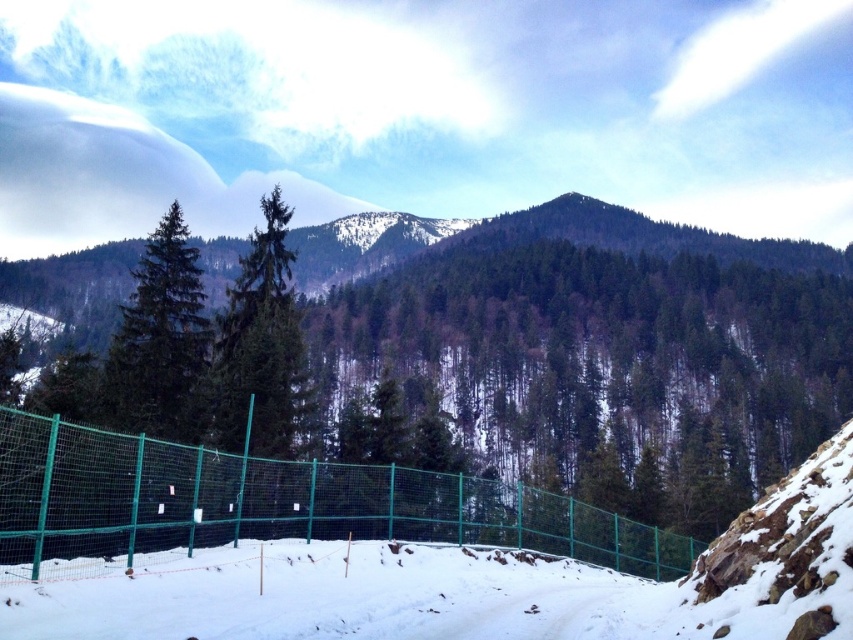
You are planning to ski down the white snow ski slope at lower center. Is there a green matte tree at center that you might hit your head on while skiing?

The green matte tree at center is positioned above the white snow ski slope at lower center, so there is a risk of hitting your head on it while skiing down.

You are planning to build a small cabin in the winter landscape. You want to ensure it has a view of both the white snow ski slope at lower center and the green matte tree at center. Considering their heights, which object will appear taller from your cabin location?

The green matte tree at center is taller than the white snow ski slope at lower center, so it will appear taller from your cabin location.

You are an outdoor enthusiast planning to cross the snow covered area in the image. You see the green wire mesh fence at center and the white snow ski slope at lower center. Which object is higher in height?

The green wire mesh fence at center is taller than the white snow ski slope at lower center.